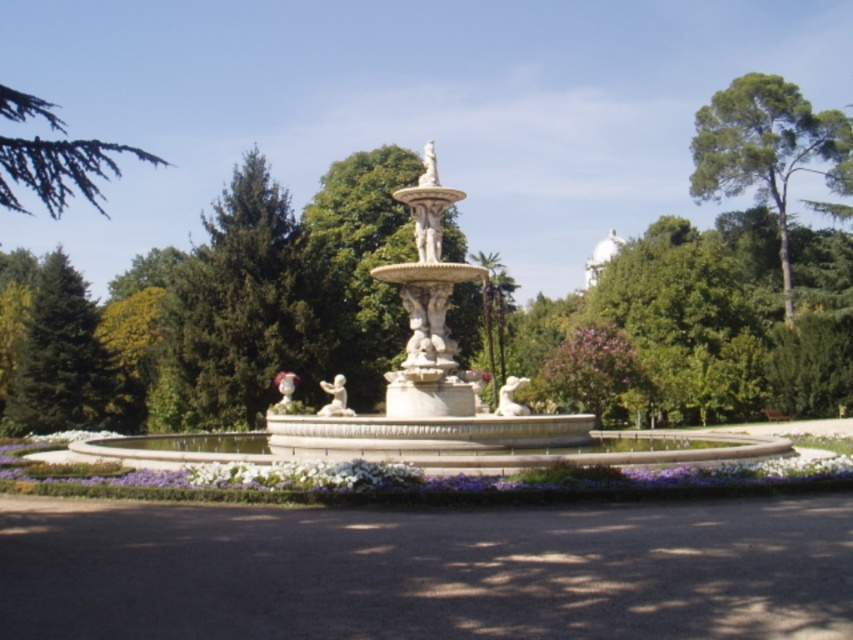
Question: Is green leafy tree at upper right bigger than green fir tree at left?

Choices:
 (A) yes
 (B) no

Answer: (A)

Question: Which of the following is the farthest from the observer?

Choices:
 (A) click(x=793, y=108)
 (B) click(x=212, y=205)
 (C) click(x=573, y=424)

Answer: (B)

Question: Which of the following is the closest to the observer?

Choices:
 (A) green fir tree at left
 (B) green leafy tree at upper right
 (C) green textured tree at upper left
 (D) white stone fountain at center

Answer: (D)

Question: From the image, what is the correct spatial relationship of white stone fountain at center in relation to green textured tree at upper left?

Choices:
 (A) left
 (B) right

Answer: (B)

Question: Which point appears farthest from the camera in this image?

Choices:
 (A) (749, 136)
 (B) (383, 280)
 (C) (76, 301)
 (D) (223, 380)

Answer: (A)

Question: Can you confirm if white stone fountain at center is bigger than green fir tree at left?

Choices:
 (A) no
 (B) yes

Answer: (B)